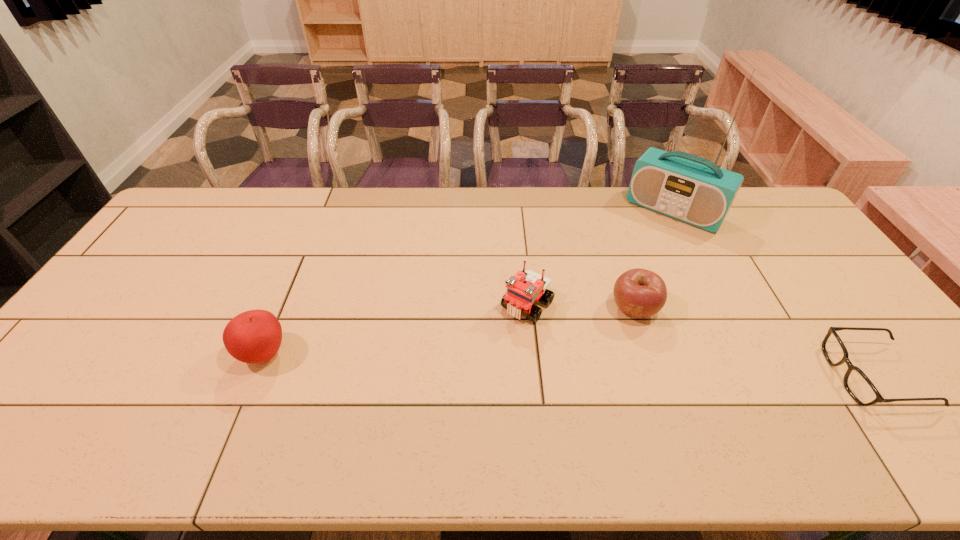
The image size is (960, 540). In order to click on blank area located on the front-facing side of the rightmost object in this screenshot , I will do `click(716, 376)`.

Where is `vacant region located on the front-facing side of the rightmost object`? The height and width of the screenshot is (540, 960). vacant region located on the front-facing side of the rightmost object is located at coordinates (761, 376).

Find the location of `vacant region located 0.120m on the front-facing side of the rightmost object`. vacant region located 0.120m on the front-facing side of the rightmost object is located at coordinates (785, 376).

At what (x,y) coordinates should I click in order to perform the action: click on free space located on the front panel of the radio receiver. Please return your answer as a coordinate pair (x, y). The image size is (960, 540). Looking at the image, I should click on (606, 299).

At what (x,y) coordinates should I click in order to perform the action: click on free location located on the front panel of the radio receiver. Please return your answer as a coordinate pair (x, y). Looking at the image, I should click on (648, 241).

At what (x,y) coordinates should I click in order to perform the action: click on vacant region located on the front panel of the radio receiver. Please return your answer as a coordinate pair (x, y). Looking at the image, I should click on (640, 251).

Locate an element on the screen. Image resolution: width=960 pixels, height=540 pixels. blank area located on the side of the shorter apple with the unique marking is located at coordinates (564, 377).

Where is `vacant space located on the side of the shorter apple with the unique marking`? Image resolution: width=960 pixels, height=540 pixels. vacant space located on the side of the shorter apple with the unique marking is located at coordinates (581, 361).

Find the location of a particular element. vacant space located on the side of the shorter apple with the unique marking is located at coordinates (594, 347).

Find the location of a particular element. The height and width of the screenshot is (540, 960). vacant region located 0.260m on the front-facing side of the Lego is located at coordinates (457, 392).